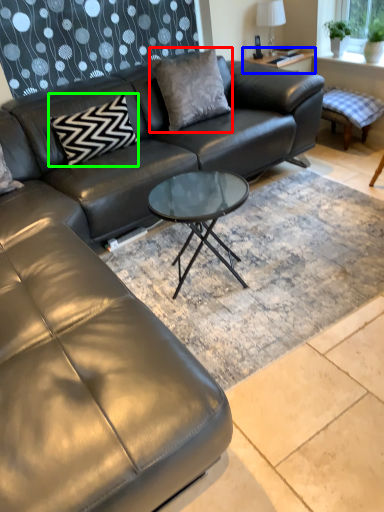
Question: Which is farther away from pillow (highlighted by a red box)? side table (highlighted by a blue box) or pillow (highlighted by a green box)?

Choices:
 (A) side table
 (B) pillow

Answer: (A)